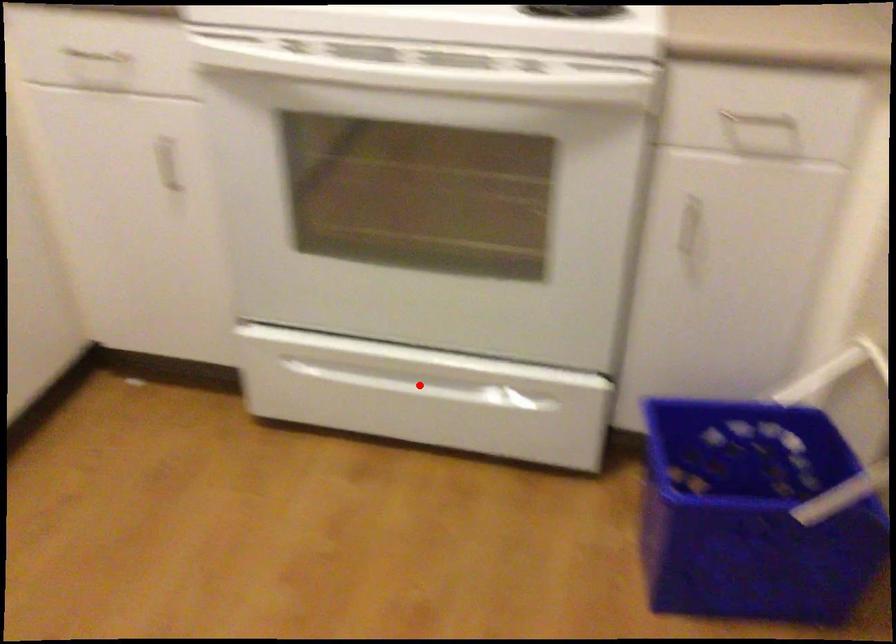
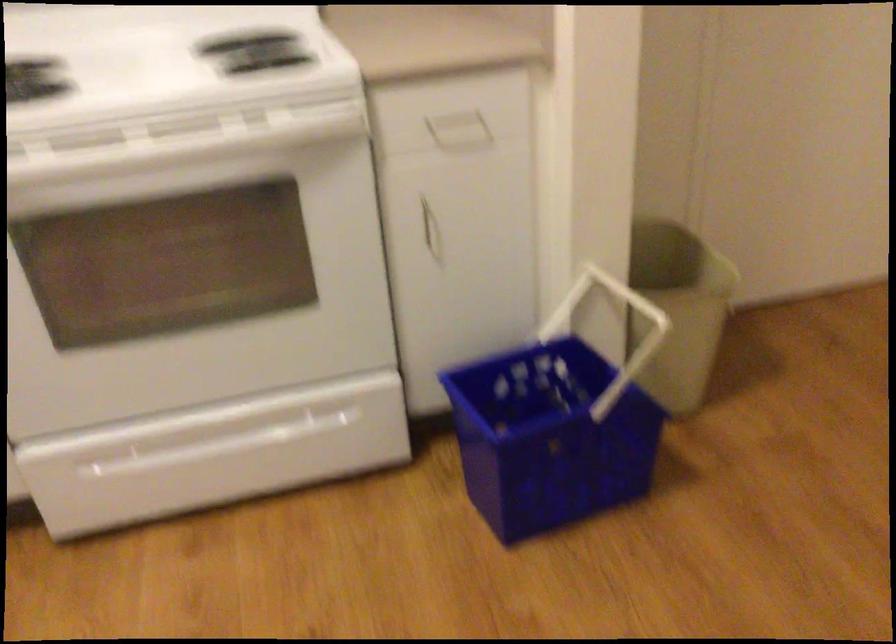
The point at the highlighted location is marked in the first image. Where is the corresponding point in the second image?

(233, 440)